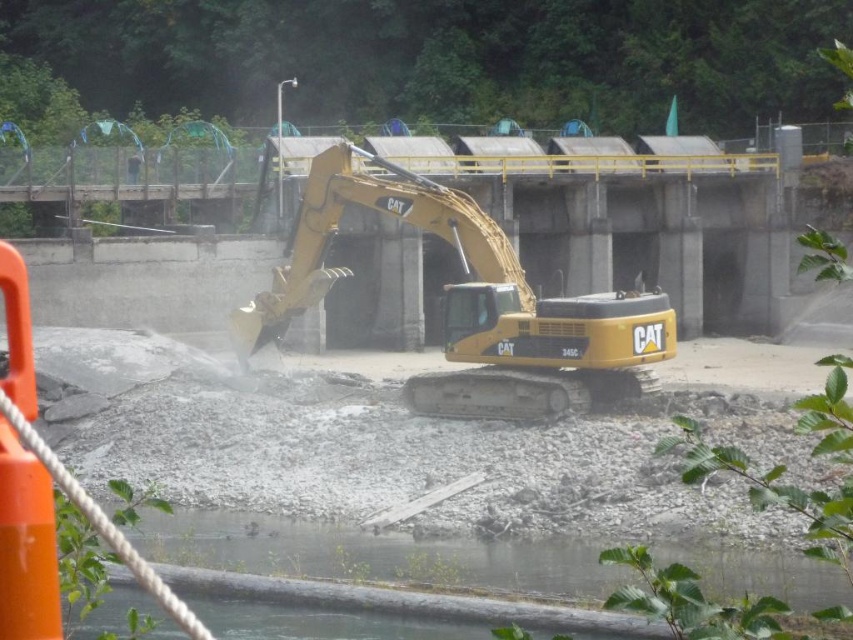
You are a construction worker standing at the edge of the construction site. You need to place a new safety sign exactly at the center of the gray gravel at center. According to the image, where should you place the safety sign?

The safety sign should be placed at the 2D coordinates point (497, 461), which is the center of the gray gravel at center.

You are an engineer inspecting the construction site. You notice the yellow metallic excavator at center and the clear water at lower center. Based on their positions, which object is closer to the ground level?

The clear water at lower center is closer to the ground level because the yellow metallic excavator at center is above it.